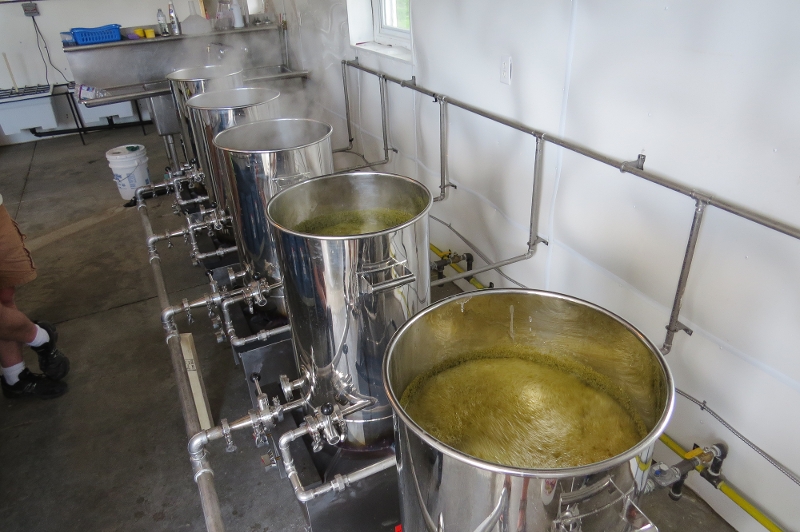
Find the location of a particular element. The height and width of the screenshot is (532, 800). pots is located at coordinates (493, 382), (322, 253), (266, 159).